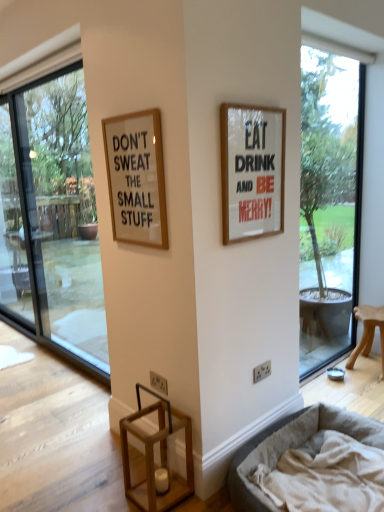
Question: Are transparent glass screen door at left and wooden stool at right beside each other?

Choices:
 (A) no
 (B) yes

Answer: (A)

Question: Is transparent glass screen door at left wider than wooden stool at right?

Choices:
 (A) no
 (B) yes

Answer: (A)

Question: Does transparent glass screen door at left lie behind wooden stool at right?

Choices:
 (A) no
 (B) yes

Answer: (B)

Question: From a real-world perspective, is transparent glass screen door at left over wooden stool at right?

Choices:
 (A) no
 (B) yes

Answer: (B)

Question: Is transparent glass screen door at left surrounding wooden stool at right?

Choices:
 (A) yes
 (B) no

Answer: (B)

Question: Can you confirm if transparent glass screen door at left is positioned to the left of wooden stool at right?

Choices:
 (A) no
 (B) yes

Answer: (B)

Question: Does white matte picture frame at upper right, the first picture frame in the right-to-left sequence, lie behind transparent glass window at left, which is the second window in right-to-left order?

Choices:
 (A) no
 (B) yes

Answer: (A)

Question: Is white matte picture frame at upper right, acting as the second picture frame starting from the left, closer to the viewer compared to transparent glass window at left, positioned as the first window in left-to-right order?

Choices:
 (A) no
 (B) yes

Answer: (B)

Question: Is white matte picture frame at upper right, the first picture frame in the right-to-left sequence, in contact with transparent glass window at left, positioned as the first window in left-to-right order?

Choices:
 (A) yes
 (B) no

Answer: (B)

Question: Considering the relative sizes of white matte picture frame at upper right, the first picture frame in the right-to-left sequence, and transparent glass window at left, which is the second window in right-to-left order, in the image provided, is white matte picture frame at upper right, the first picture frame in the right-to-left sequence, wider than transparent glass window at left, which is the second window in right-to-left order,?

Choices:
 (A) no
 (B) yes

Answer: (A)

Question: Is white matte picture frame at upper right, the first picture frame in the right-to-left sequence, positioned far away from transparent glass window at left, which is the second window in right-to-left order?

Choices:
 (A) no
 (B) yes

Answer: (B)

Question: Considering the relative positions of white matte picture frame at upper right, acting as the second picture frame starting from the left, and transparent glass window at left, which is the second window in right-to-left order, in the image provided, is white matte picture frame at upper right, acting as the second picture frame starting from the left, to the left of transparent glass window at left, which is the second window in right-to-left order, from the viewer's perspective?

Choices:
 (A) yes
 (B) no

Answer: (B)

Question: Is transparent glass window at left, which is the second window in right-to-left order, closer to the viewer compared to white matte picture frame at upper right, acting as the second picture frame starting from the left?

Choices:
 (A) yes
 (B) no

Answer: (B)